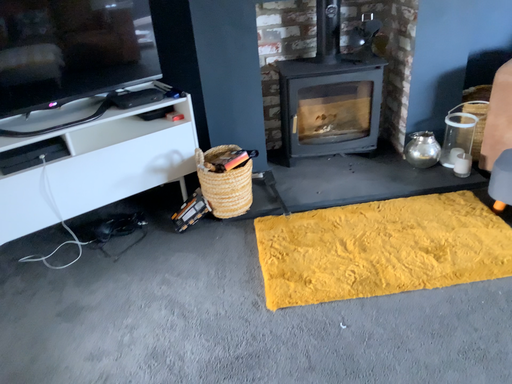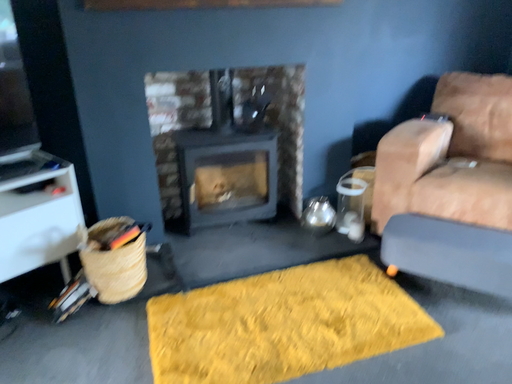
Question: Which way did the camera rotate in the video?

Choices:
 (A) rotated upward
 (B) rotated downward

Answer: (A)